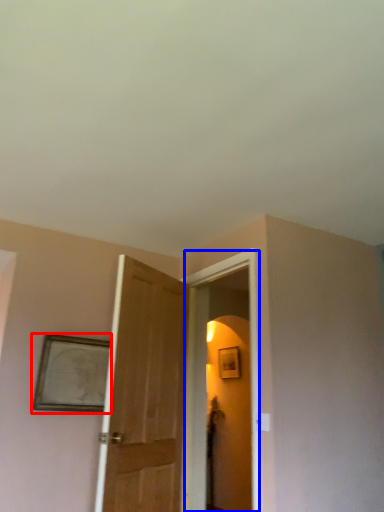
Question: Among these objects, which one is farthest to the camera, picture frame (highlighted by a red box) or screen door (highlighted by a blue box)?

Choices:
 (A) picture frame
 (B) screen door

Answer: (A)